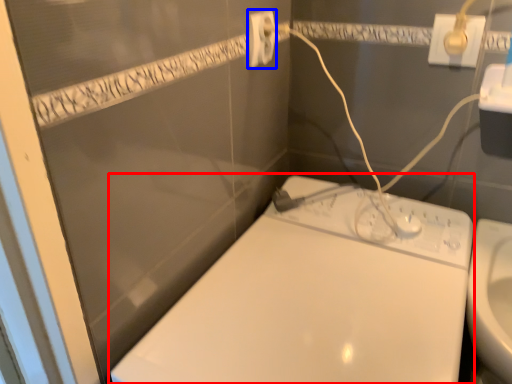
Question: Among these objects, which one is farthest to the camera, toilet (highlighted by a red box) or power plugs and sockets (highlighted by a blue box)?

Choices:
 (A) toilet
 (B) power plugs and sockets

Answer: (B)